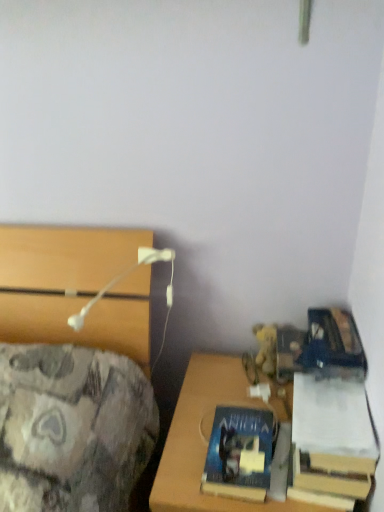
You are a GUI agent. You are given a task and a screenshot of the screen. Output one action in this format:
    pyautogui.click(x=<x>, y=<y>)
    Task: Click on the vacant area to the left of hardcover book at lower right, which is the 2th book from left to right
    
    Given the screenshot: What is the action you would take?
    pyautogui.click(x=230, y=418)